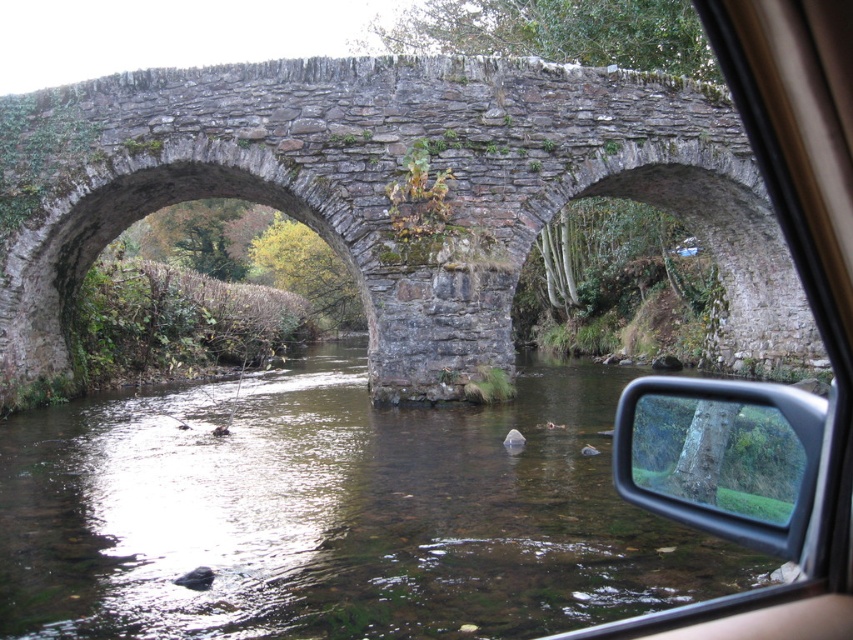
Question: Does clear water at center appear on the left side of rustic stone bridge at center?

Choices:
 (A) no
 (B) yes

Answer: (B)

Question: Considering the real-world distances, which object is farthest from the transparent glass mirror at center?

Choices:
 (A) clear water at center
 (B) rustic stone bridge at center

Answer: (B)

Question: Does rustic stone bridge at center appear on the left side of transparent glass mirror at center?

Choices:
 (A) yes
 (B) no

Answer: (A)

Question: Which point is closer to the camera?

Choices:
 (A) (795, 388)
 (B) (616, 147)
 (C) (1, 516)

Answer: (C)

Question: Is rustic stone bridge at center further to the viewer compared to transparent glass mirror at center?

Choices:
 (A) yes
 (B) no

Answer: (A)

Question: Which point is closer to the camera?

Choices:
 (A) clear water at center
 (B) transparent glass mirror at center
 (C) rustic stone bridge at center

Answer: (B)